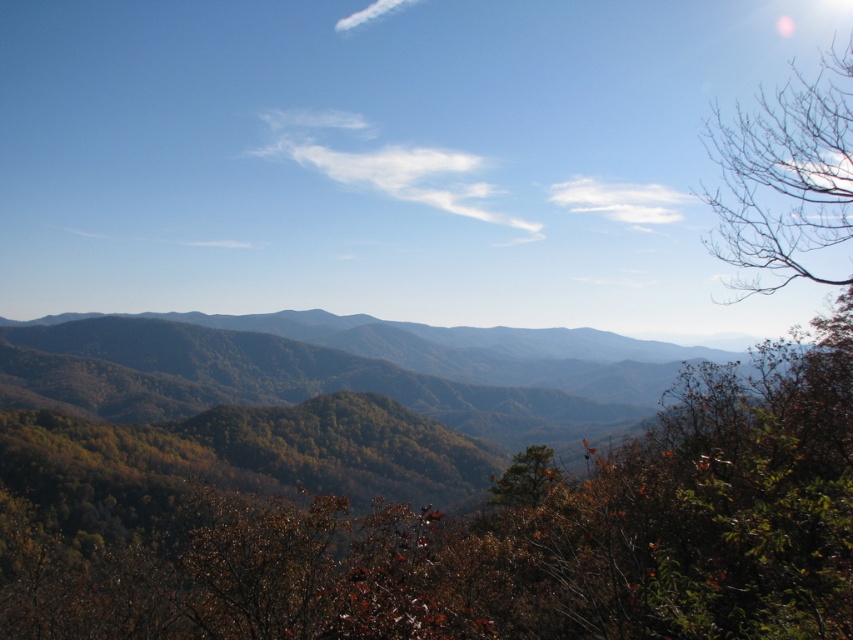
Question: Does bare branches at upper right appear on the right side of green matte tree at center?

Choices:
 (A) yes
 (B) no

Answer: (A)

Question: Based on their relative distances, which object is farther from the green matte tree at center?

Choices:
 (A) bare branches at upper right
 (B) green leafy tree at center

Answer: (A)

Question: Does green leafy tree at center have a smaller size compared to green matte tree at center?

Choices:
 (A) yes
 (B) no

Answer: (B)

Question: Which object is closer to the camera taking this photo?

Choices:
 (A) green leafy tree at center
 (B) bare branches at upper right
 (C) green matte tree at center

Answer: (A)

Question: Can you confirm if green leafy tree at center is smaller than bare branches at upper right?

Choices:
 (A) yes
 (B) no

Answer: (A)

Question: Which point appears closest to the camera in this image?

Choices:
 (A) (503, 493)
 (B) (755, 588)

Answer: (B)